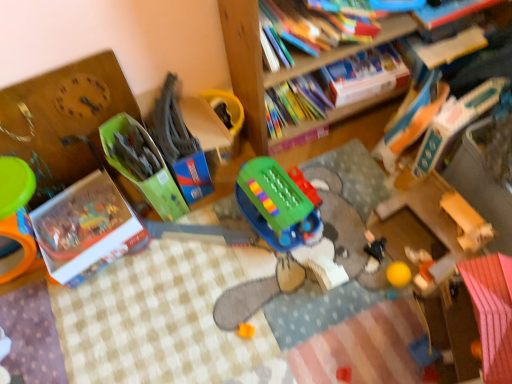
I want to click on free space to the left of green plastic toy at center, the fourth toy when ordered from left to right, so click(x=205, y=238).